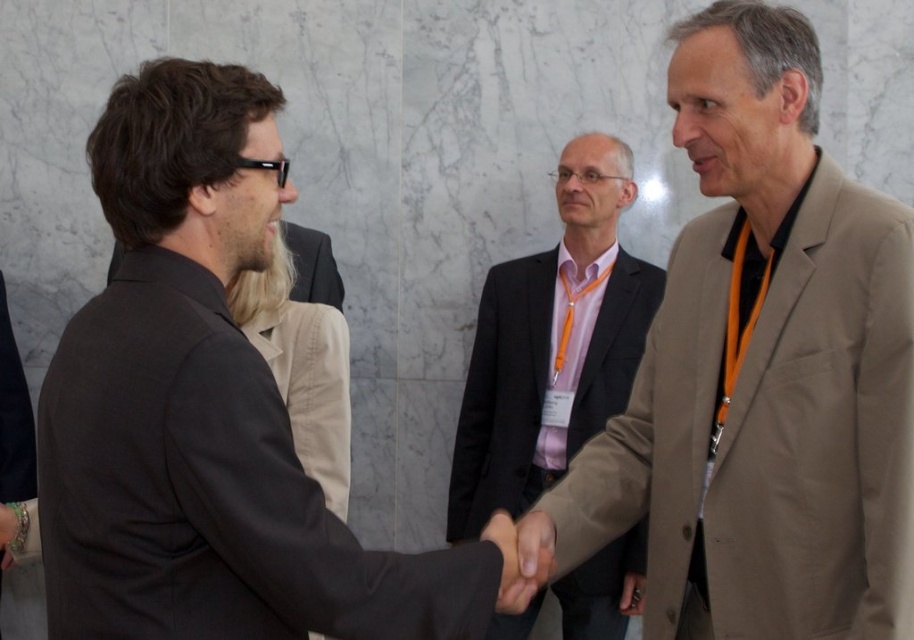
Question: Which object appears farthest from the camera in this image?

Choices:
 (A) matte black suit at left
 (B) beige fabric suit at right
 (C) dark gray suit at center

Answer: (C)

Question: Is beige fabric suit at right to the left of dark gray suit at center from the viewer's perspective?

Choices:
 (A) yes
 (B) no

Answer: (B)

Question: Which point is farther to the camera?

Choices:
 (A) dark gray suit at center
 (B) matte black suit at left

Answer: (A)

Question: Can you confirm if beige fabric suit at right is smaller than matte black suit at left?

Choices:
 (A) yes
 (B) no

Answer: (B)

Question: Is beige fabric suit at right above dark gray suit at center?

Choices:
 (A) yes
 (B) no

Answer: (A)

Question: Which object is positioned farthest from the matte black suit at left?

Choices:
 (A) dark gray suit at center
 (B) beige fabric suit at right

Answer: (A)